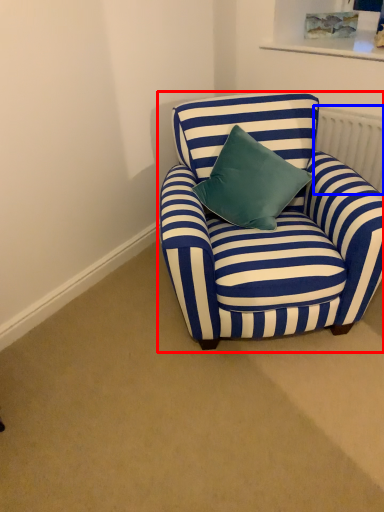
Question: Among these objects, which one is farthest to the camera, chair (highlighted by a red box) or radiator (highlighted by a blue box)?

Choices:
 (A) chair
 (B) radiator

Answer: (B)